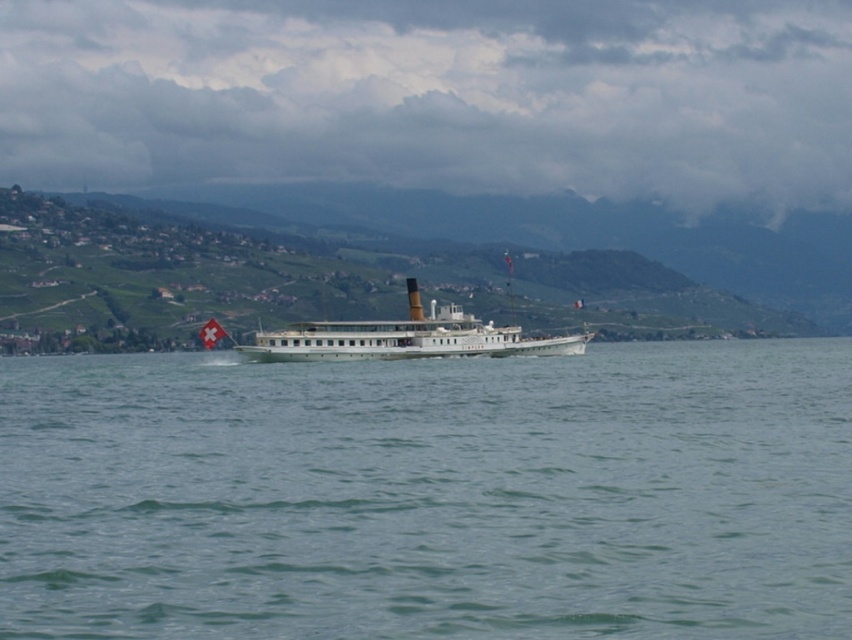
Can you confirm if green water at center is wider than white polished wood cruise ship at center?

Yes.

Does green water at center appear on the right side of white polished wood cruise ship at center?

Incorrect, green water at center is not on the right side of white polished wood cruise ship at center.

What do you see at coordinates (430, 493) in the screenshot?
I see `green water at center` at bounding box center [430, 493].

Where is `green water at center`? green water at center is located at coordinates (430, 493).